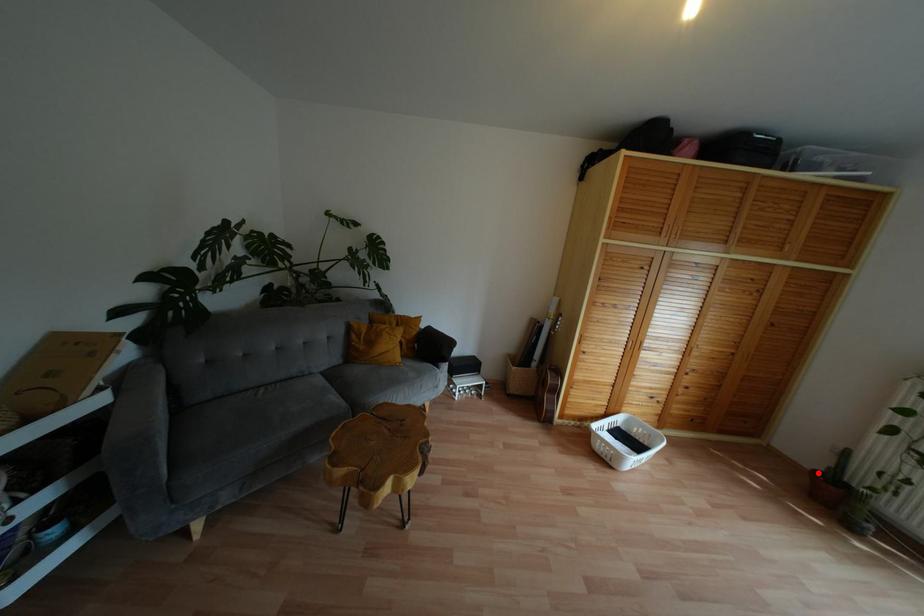
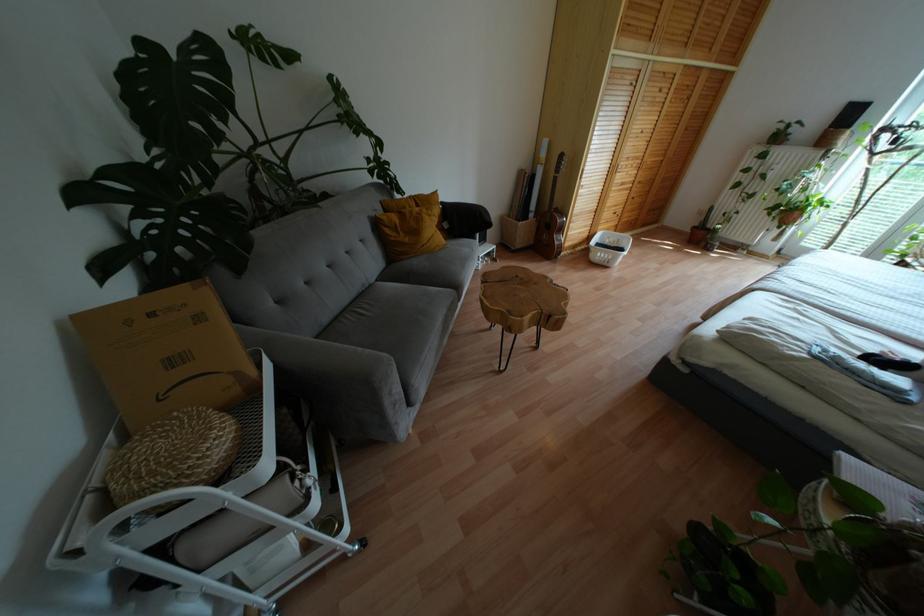
In the second image, find the point that corresponds to the highlighted location in the first image.

(694, 227)